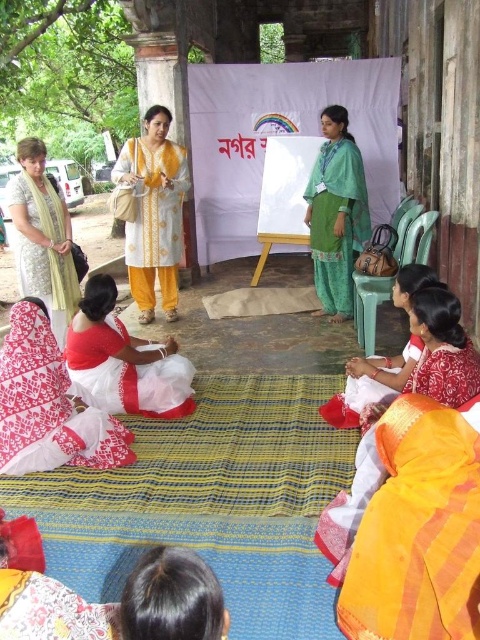
You are a photographer at the event and want to capture a photo that includes both the white cotton kurta at center and the white cotton saree at lower right. However, you need to ensure that the saree is not blocked by the kurta. Based on their positions, is this possible?

The white cotton saree at lower right is behind the white cotton kurta at center, so it will be blocked. To capture both without obstruction, you might need to adjust your angle or have the participants shift positions slightly.

You are standing at the back of the gathering and want to greet the person in the silky orange saree at lower right and the person in the white cotton kurta at center. Which one can you reach first by walking straight ahead?

The silky orange saree at lower right is closer to the viewer than the white cotton kurta at center, so you can reach the person in the silky orange saree at lower right first by walking straight ahead.

You are a photographer trying to capture a balanced composition. You notice the white printed saree at lower left and the white cotton saree at lower right. Which saree should you adjust to ensure both are equally visible in the frame?

The white printed saree at lower left has a lesser height compared to the white cotton saree at lower right. To balance the composition, you should raise the white printed saree at lower left to match the height of the white cotton saree at lower right.